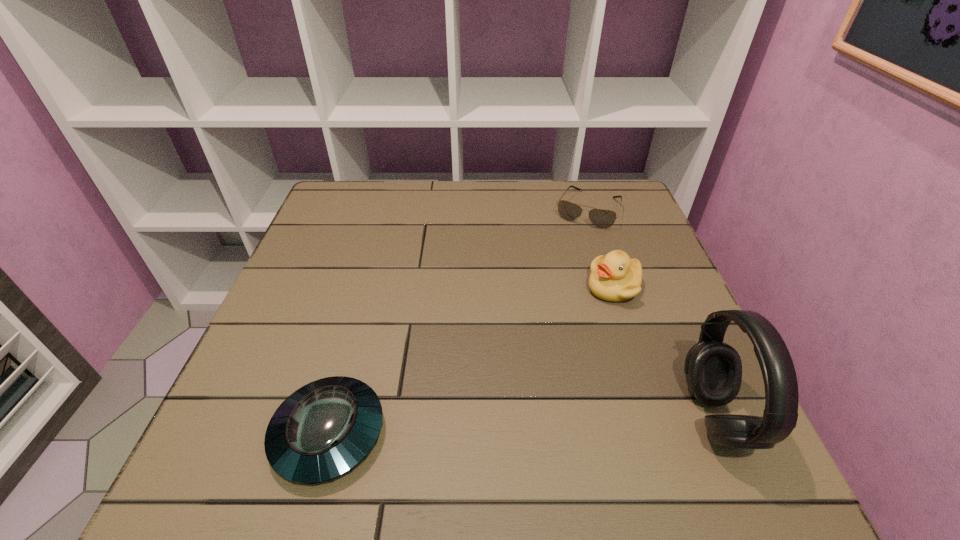
This screenshot has width=960, height=540. Identify the location of object that is positioned at the far right corner. (601, 218).

Where is `object situated at the near right corner`? This screenshot has width=960, height=540. object situated at the near right corner is located at coordinates (713, 369).

In the image, there is a desktop. Find the location of `vacant space at the far edge`. vacant space at the far edge is located at coordinates (382, 226).

In the image, there is a desktop. Where is `free space at the left edge`? This screenshot has width=960, height=540. free space at the left edge is located at coordinates (323, 233).

Find the location of a particular element. free region at the right edge of the desktop is located at coordinates (680, 343).

Find the location of a particular element. Image resolution: width=960 pixels, height=540 pixels. vacant region at the far left corner is located at coordinates (351, 200).

Locate an element on the screen. vacant space at the near left corner is located at coordinates (255, 396).

Identify the location of vacant space at the far right corner. Image resolution: width=960 pixels, height=540 pixels. (627, 225).

At what (x,y) coordinates should I click in order to perform the action: click on free space between the third shortest object and the leftmost object. Please return your answer as a coordinate pair (x, y). The image size is (960, 540). Looking at the image, I should click on pyautogui.click(x=471, y=361).

Identify the location of vacant area that lies between the third shortest object and the leftmost object. The width and height of the screenshot is (960, 540). (471, 361).